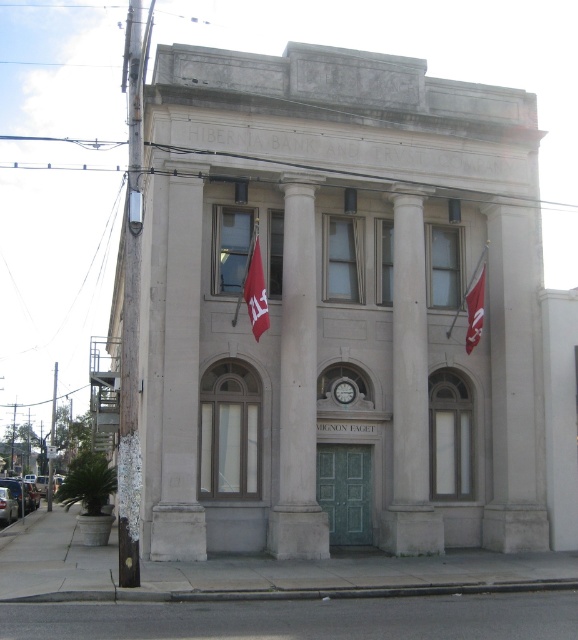
Question: Can you confirm if red fabric flag at center is wider than metallic pole at left?

Choices:
 (A) yes
 (B) no

Answer: (B)

Question: Does red fabric flag at right appear over metallic pole at left?

Choices:
 (A) no
 (B) yes

Answer: (B)

Question: Does white stone column at center have a smaller size compared to red fabric flag at right?

Choices:
 (A) yes
 (B) no

Answer: (B)

Question: Which object is the farthest from the red fabric flag at center?

Choices:
 (A) white stone column at center
 (B) white smooth pillar at center
 (C) metallic pole at left
 (D) red fabric flag at right

Answer: (C)

Question: Which of the following is the farthest from the observer?

Choices:
 (A) metallic pole at left
 (B) white smooth column at center
 (C) white stone column at center
 (D) white smooth pillar at center

Answer: (A)

Question: Considering the real-world distances, which object is farthest from the red fabric flag at center?

Choices:
 (A) white stone column at center
 (B) white smooth column at center

Answer: (B)